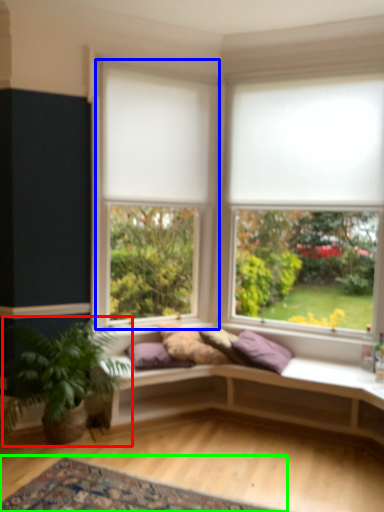
Question: Estimate the real-world distances between objects in this image. Which object is closer to houseplant (highlighted by a red box), window (highlighted by a blue box) or mat (highlighted by a green box)?

Choices:
 (A) window
 (B) mat

Answer: (B)